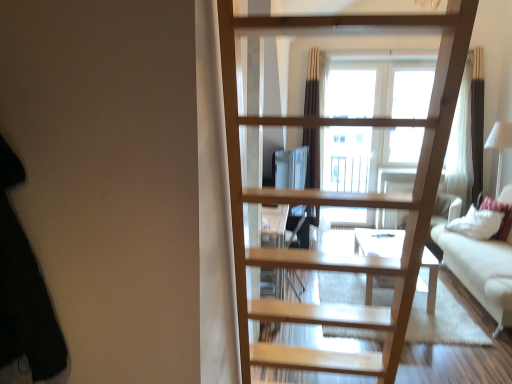
Question: Is black fabric at left situated inside white soft pillow at right or outside?

Choices:
 (A) outside
 (B) inside

Answer: (A)

Question: From the image's perspective, is black fabric at left positioned above or below white soft pillow at right?

Choices:
 (A) below
 (B) above

Answer: (B)

Question: Estimate the real-world distances between objects in this image. Which object is closer to the white soft pillow at right?

Choices:
 (A) natural wood ladder at center
 (B) white fabric couch at right
 (C) black fabric at left

Answer: (B)

Question: Which of these objects is positioned closest to the white fabric couch at right?

Choices:
 (A) natural wood ladder at center
 (B) white soft pillow at right
 (C) black fabric at left

Answer: (B)